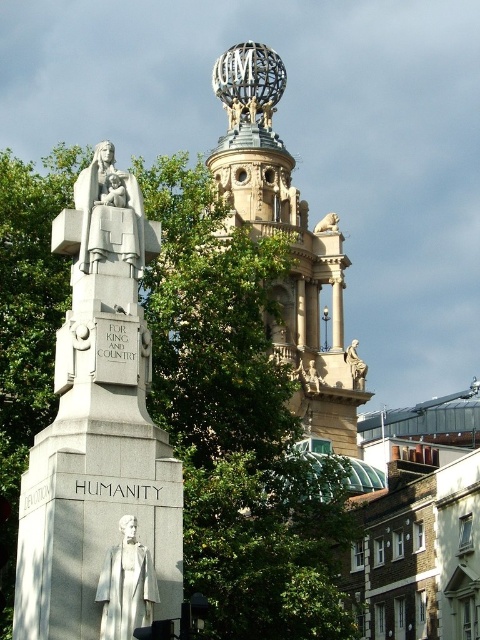
Is white marble statue at center smaller than polished bronze statue at upper right?

Yes.

Which is in front, point (155, 579) or point (351, 381)?

Positioned in front is point (155, 579).

You are a GUI agent. You are given a task and a screenshot of the screen. Output one action in this format:
    pyautogui.click(x=<x>, y=<y>)
    Task: Click on the white marble statue at center
    The image size is (480, 640).
    Given the screenshot: What is the action you would take?
    (127, 586)

Which is behind, point (242, 193) or point (106, 237)?

Positioned behind is point (242, 193).

Does gold ornate tower at center have a larger size compared to white marble statue at upper left?

Correct, gold ornate tower at center is larger in size than white marble statue at upper left.

Measure the distance between point (291, 401) and camera.

Point (291, 401) is 121.07 meters away from camera.

Where is `gold ornate tower at center`? The width and height of the screenshot is (480, 640). gold ornate tower at center is located at coordinates (292, 243).

Can you confirm if gold ornate tower at center is smaller than white marble statue at center?

Incorrect, gold ornate tower at center is not smaller in size than white marble statue at center.

Measure the distance between gold ornate tower at center and white marble statue at center.

gold ornate tower at center is 85.73 meters away from white marble statue at center.

This screenshot has height=640, width=480. I want to click on gold ornate tower at center, so click(x=292, y=243).

Identify the location of gold ornate tower at center. The width and height of the screenshot is (480, 640). (292, 243).